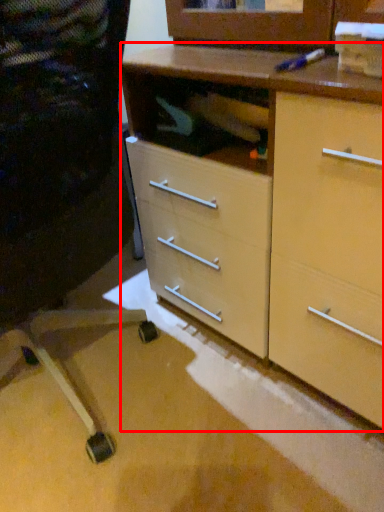
Question: Where is chest of drawers (annotated by the red box) located in relation to computer chair in the image?

Choices:
 (A) right
 (B) left

Answer: (A)